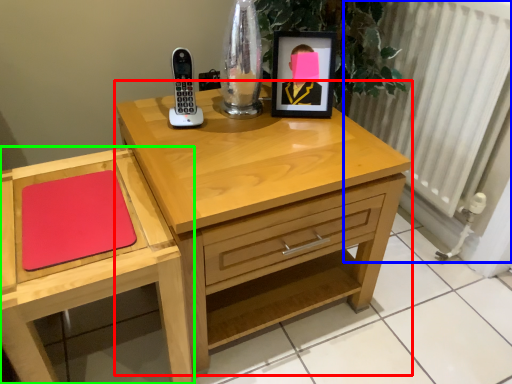
Question: Which object is positioned closest to nightstand (highlighted by a red box)? Select from radiator (highlighted by a blue box) and chest of drawers (highlighted by a green box).

Choices:
 (A) radiator
 (B) chest of drawers

Answer: (B)